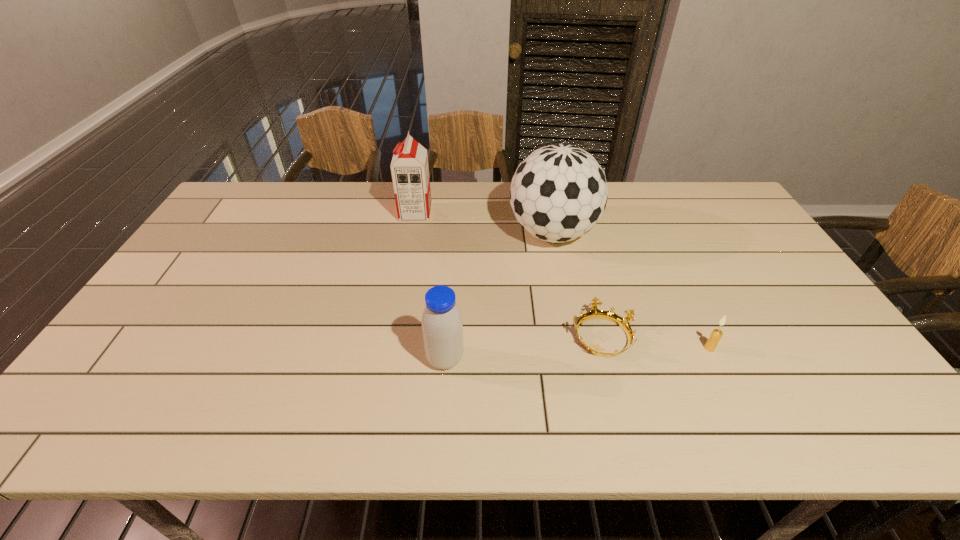
Where is `vacant area that lies between the soccer ball and the shorter soya milk`? This screenshot has height=540, width=960. vacant area that lies between the soccer ball and the shorter soya milk is located at coordinates (499, 296).

Identify the location of free space between the soccer ball and the second shortest object. coord(631,291).

Find the location of `free space between the taller soya milk and the right soya milk`. free space between the taller soya milk and the right soya milk is located at coordinates (430, 286).

Locate an element on the screen. vacant region between the soccer ball and the crown is located at coordinates (577, 285).

Where is `vacant space that is in between the shortest object and the left soya milk`? The image size is (960, 540). vacant space that is in between the shortest object and the left soya milk is located at coordinates (509, 274).

Where is `vacant space that is in between the candle and the farther soya milk`? The width and height of the screenshot is (960, 540). vacant space that is in between the candle and the farther soya milk is located at coordinates (563, 281).

What are the coordinates of `free space between the shorter soya milk and the crown` in the screenshot? It's located at (523, 348).

What are the coordinates of `free space that is in between the shortest object and the candle` in the screenshot? It's located at (656, 342).

The width and height of the screenshot is (960, 540). Identify the location of free space that is in between the soccer ball and the leftmost object. (484, 223).

Where is `vacant area that lies between the crown and the second shortest object`? Image resolution: width=960 pixels, height=540 pixels. vacant area that lies between the crown and the second shortest object is located at coordinates (656, 342).